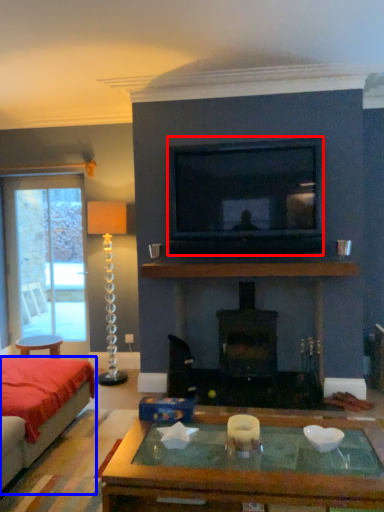
Question: Which object appears closest to the camera in this image, television (highlighted by a red box) or studio couch (highlighted by a blue box)?

Choices:
 (A) television
 (B) studio couch

Answer: (B)